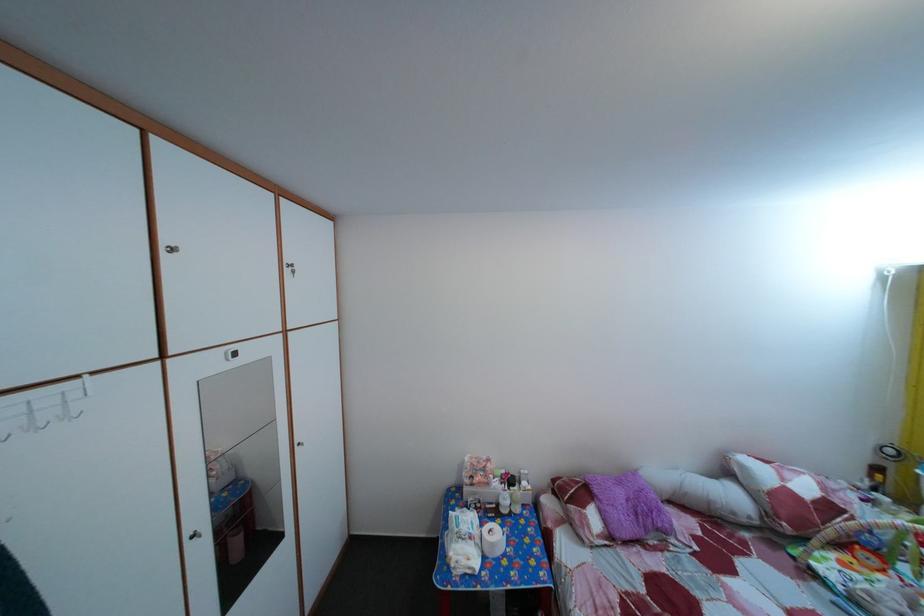
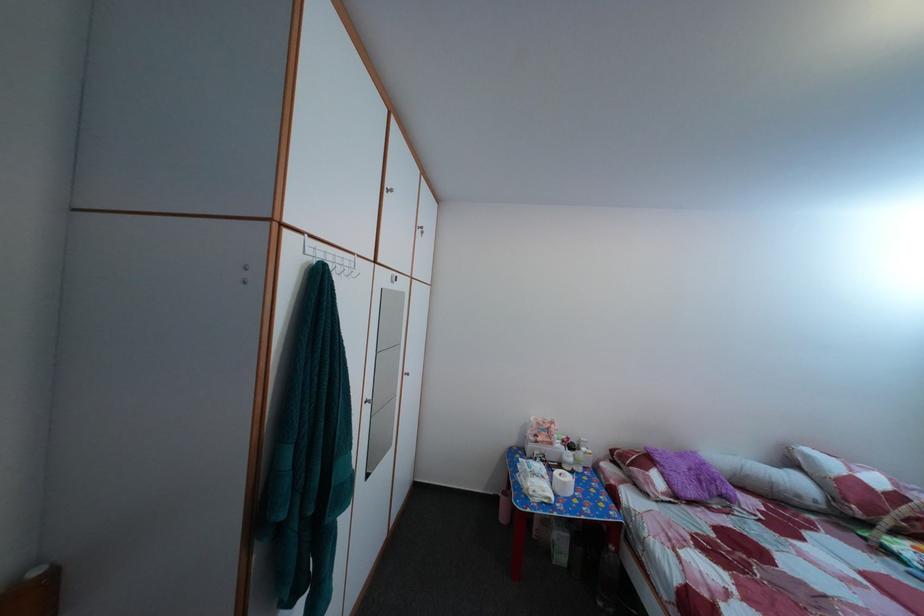
The point at (473, 570) is marked in the first image. Where is the corresponding point in the second image?

(551, 500)